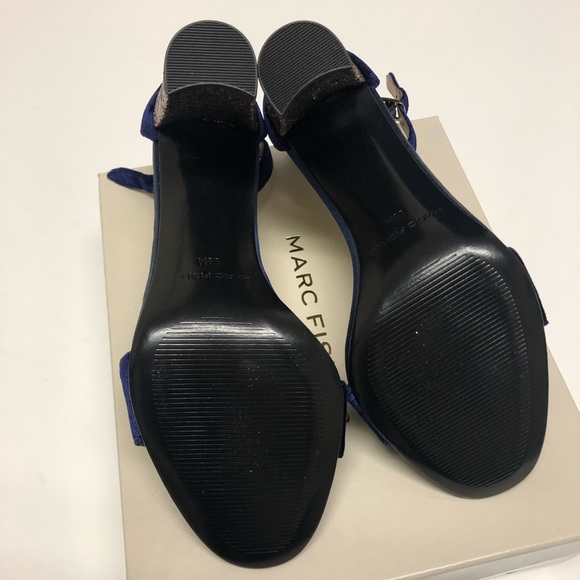
This screenshot has width=580, height=580. I want to click on box, so click(369, 508).